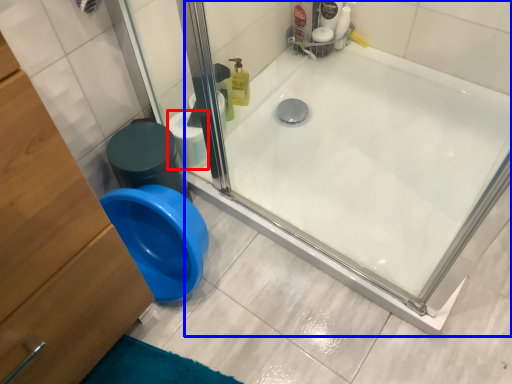
Question: Which of the following is the farthest to the observer, toilet paper (highlighted by a red box) or bathtub (highlighted by a blue box)?

Choices:
 (A) toilet paper
 (B) bathtub

Answer: (A)